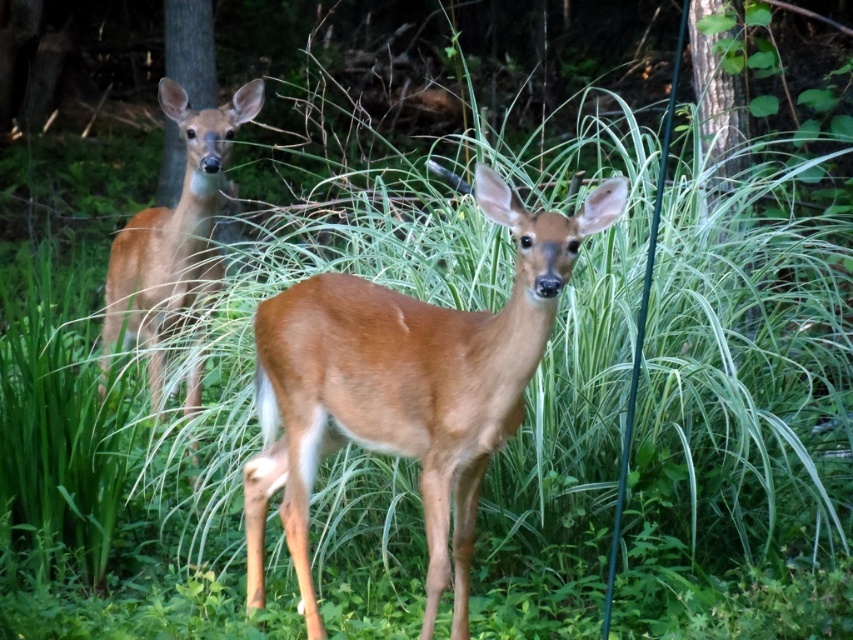
Question: Is brown matte deer at center positioned at the back of brown matte/deer at center?

Choices:
 (A) yes
 (B) no

Answer: (B)

Question: Does brown matte deer at center have a smaller size compared to brown matte/deer at center?

Choices:
 (A) yes
 (B) no

Answer: (A)

Question: Which of the following is the closest to the observer?

Choices:
 (A) (419, 376)
 (B) (154, 317)

Answer: (A)

Question: Is brown matte deer at center positioned at the back of brown matte/deer at center?

Choices:
 (A) no
 (B) yes

Answer: (A)

Question: Which of the following is the closest to the observer?

Choices:
 (A) brown matte/deer at center
 (B) brown matte deer at center

Answer: (B)